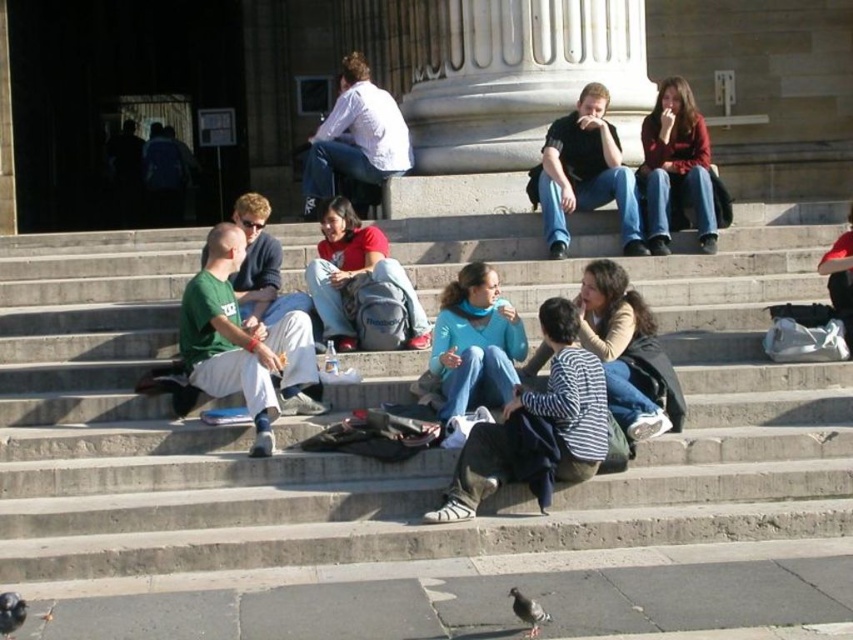
Who is positioned more to the right, black cotton shirt at center or gray matte pigeon at lower center?

Positioned to the right is black cotton shirt at center.

How much distance is there between black cotton shirt at center and gray matte pigeon at lower center?

A distance of 17.67 meters exists between black cotton shirt at center and gray matte pigeon at lower center.

Does point (614, 173) lie in front of point (515, 612)?

No, (614, 173) is behind (515, 612).

The width and height of the screenshot is (853, 640). In order to click on black cotton shirt at center in this screenshot , I will do `click(584, 173)`.

Can you confirm if concrete stairs at center is positioned above gray matte pigeon at lower left?

Correct, concrete stairs at center is located above gray matte pigeon at lower left.

Is point (380, 364) closer to viewer compared to point (10, 604)?

No.

Where is `concrete stairs at center`? The height and width of the screenshot is (640, 853). concrete stairs at center is located at coordinates (376, 404).

Which is behind, point (790, 246) or point (618, 164)?

The point (790, 246) is more distant.

Locate an element on the screen. The height and width of the screenshot is (640, 853). concrete stairs at center is located at coordinates (376, 404).

Where is `concrete stairs at center`? concrete stairs at center is located at coordinates (376, 404).